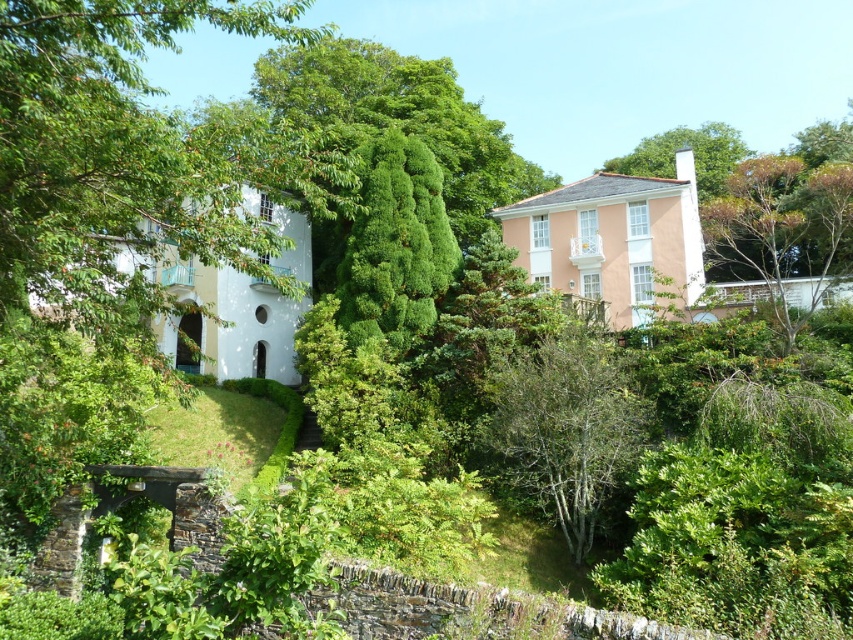
Question: Which of the following is the farthest from the observer?

Choices:
 (A) (445, 266)
 (B) (775, 250)
 (C) (669, 141)
 (D) (589, 420)

Answer: (C)

Question: In this image, where is green leafy tree at center located relative to green leafy tree at upper right?

Choices:
 (A) right
 (B) left

Answer: (B)

Question: Does green leafy tree at center have a larger size compared to brown textured tree at upper right?

Choices:
 (A) yes
 (B) no

Answer: (B)

Question: Which object is closer to the camera taking this photo?

Choices:
 (A) green leafy tree at center
 (B) green leafy tree at upper right
 (C) brown textured tree at upper right
 (D) green needle-like at center

Answer: (A)

Question: Which object is the farthest from the brown textured tree at upper right?

Choices:
 (A) green needle-like at center
 (B) green leafy tree at center

Answer: (A)

Question: Can you confirm if green needle-like at center is positioned below green leafy tree at upper right?

Choices:
 (A) no
 (B) yes

Answer: (B)